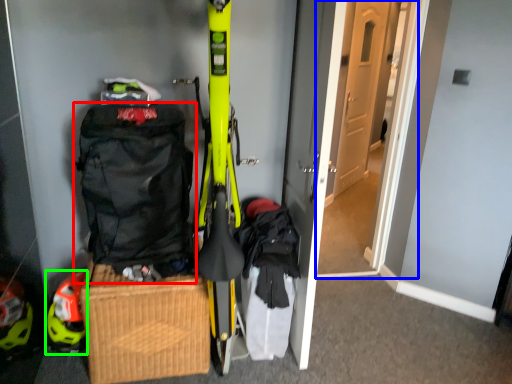
Question: Which object is the closest to the backpack (highlighted by a red box)? Choose among these: door (highlighted by a blue box) or helmet (highlighted by a green box).

Choices:
 (A) door
 (B) helmet

Answer: (B)